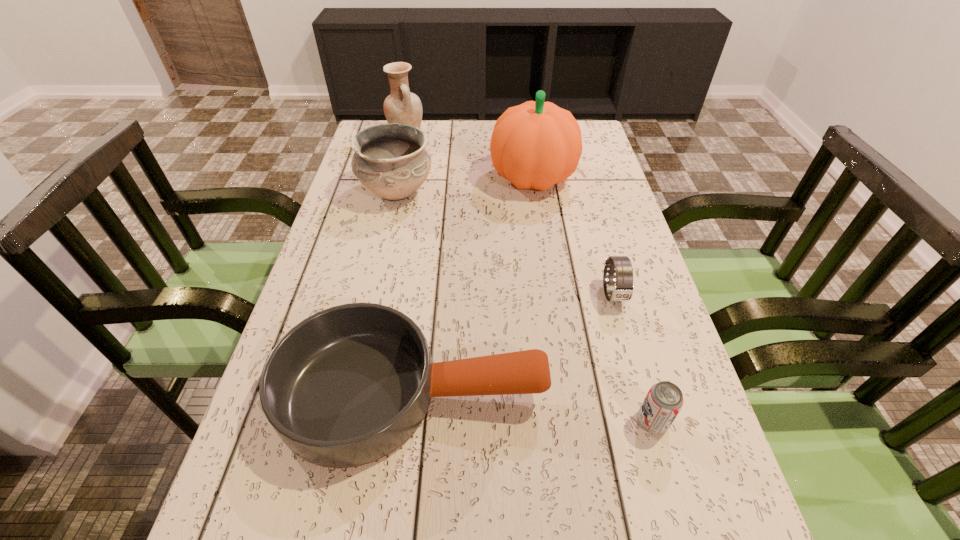
The height and width of the screenshot is (540, 960). I want to click on object situated at the far left corner, so click(x=401, y=106).

Identify the location of object located at the far right corner. Image resolution: width=960 pixels, height=540 pixels. (535, 145).

At what (x,y) coordinates should I click in order to perform the action: click on vacant space at the left edge of the desktop. Please return your answer as a coordinate pair (x, y). Looking at the image, I should click on (246, 506).

At what (x,y) coordinates should I click in order to perform the action: click on vacant area at the right edge. Please return your answer as a coordinate pair (x, y). Looking at the image, I should click on (627, 393).

Image resolution: width=960 pixels, height=540 pixels. In order to click on free space between the farther pottery and the watch in this screenshot , I will do `click(510, 215)`.

Identify the location of unoccupied position between the fourth shortest object and the tallest object. The height and width of the screenshot is (540, 960). coord(465,185).

This screenshot has width=960, height=540. What are the coordinates of `vacant space that's between the pan and the pumpkin` in the screenshot? It's located at (473, 286).

Locate an element on the screen. unoccupied area between the beer can and the pan is located at coordinates (533, 407).

You are a GUI agent. You are given a task and a screenshot of the screen. Output one action in this format:
    pyautogui.click(x=<x>, y=<y>)
    Task: Click on the free space between the beer can and the farthest object
    This screenshot has height=540, width=960.
    Given the screenshot: What is the action you would take?
    pyautogui.click(x=529, y=278)

Where is `unoccupied position between the pumpkin and the beer can`? The height and width of the screenshot is (540, 960). unoccupied position between the pumpkin and the beer can is located at coordinates (592, 300).